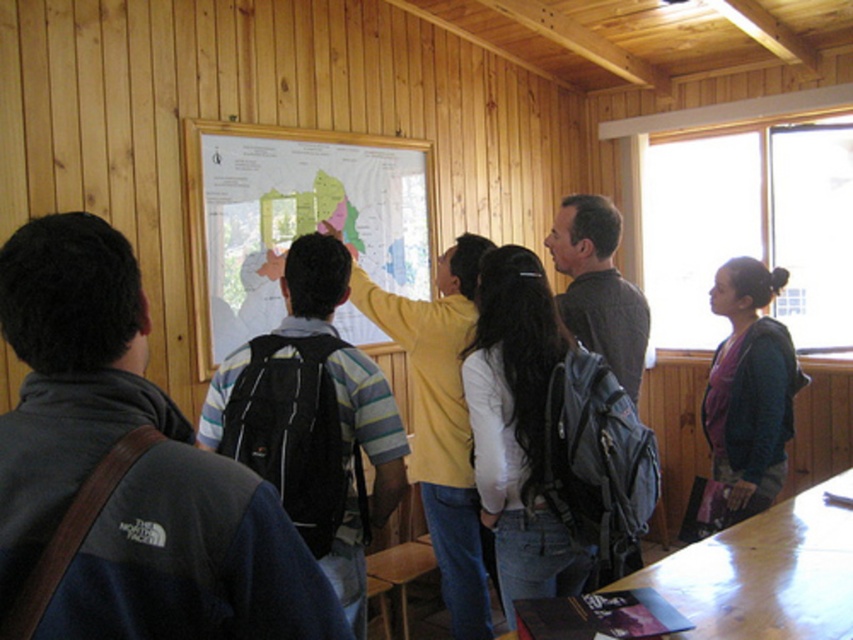
You are standing in the wooden paneled room and want to locate the white matte map at center. According to the coordinates provided, where should you look?

You should look at point (294, 216) to find the white matte map at center.

You are standing at the entrance of the room and see the yellow matte shirt at center and the purple fleece jacket at right. Which person is closer to you?

The yellow matte shirt at center is closer to you because it is in front of the purple fleece jacket at right.